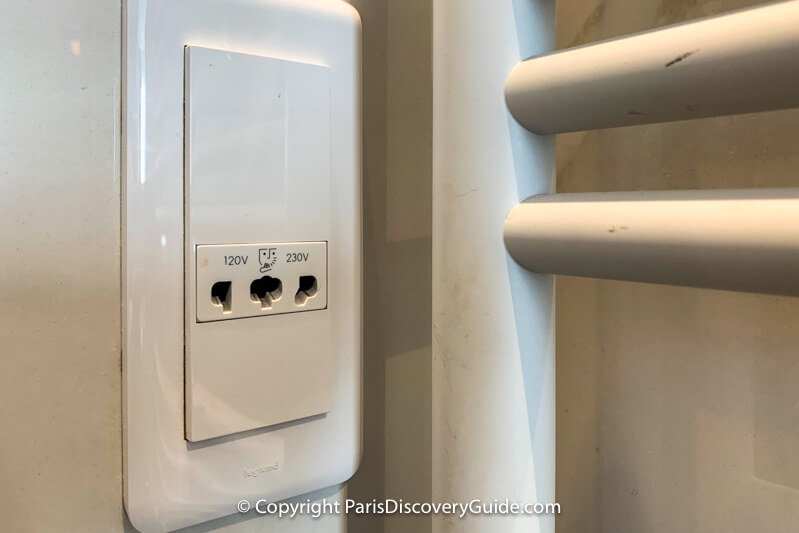
Identify the location of outlet. The height and width of the screenshot is (533, 799). (280, 356).